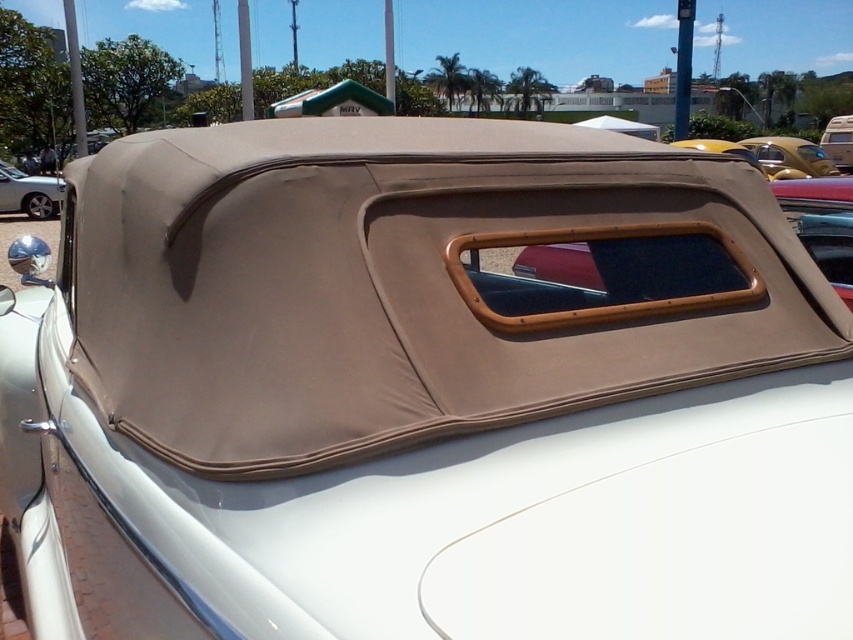
In the scene shown: Can you confirm if beige fabric convertible top at center is positioned below matte black car at left?

No, beige fabric convertible top at center is not below matte black car at left.

Does beige fabric convertible top at center appear on the left side of matte black car at left?

Incorrect, beige fabric convertible top at center is not on the left side of matte black car at left.

Does point (764, 156) come behind point (51, 195)?

Yes, point (764, 156) is farther from viewer.

This screenshot has height=640, width=853. Find the location of `beige fabric convertible top at center`. beige fabric convertible top at center is located at coordinates (788, 156).

Can you confirm if matte black car at left is smaller than beige fabric car at center?

Correct, matte black car at left occupies less space than beige fabric car at center.

Can you confirm if matte black car at left is thinner than beige fabric car at center?

No.

This screenshot has height=640, width=853. I want to click on matte black car at left, so click(28, 193).

Which of these two, beige fabric convertible top at center or beige fabric car at center, stands taller?

Standing taller between the two is beige fabric car at center.

Can you confirm if beige fabric convertible top at center is shorter than beige fabric car at center?

Indeed, beige fabric convertible top at center has a lesser height compared to beige fabric car at center.

Does point (779, 163) lie behind point (849, 124)?

No, (779, 163) is in front of (849, 124).

You are a GUI agent. You are given a task and a screenshot of the screen. Output one action in this format:
    pyautogui.click(x=<x>, y=<y>)
    Task: Click on the beige fabric convertible top at center
    This screenshot has height=640, width=853.
    Given the screenshot: What is the action you would take?
    pyautogui.click(x=788, y=156)